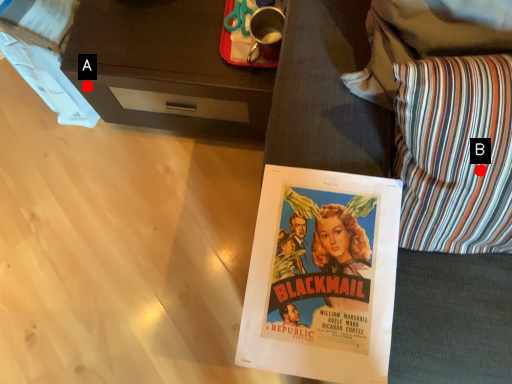
Question: Two points are circled on the image, labeled by A and B beside each circle. Which point appears farthest from the camera in this image?

Choices:
 (A) A is further
 (B) B is further

Answer: (A)